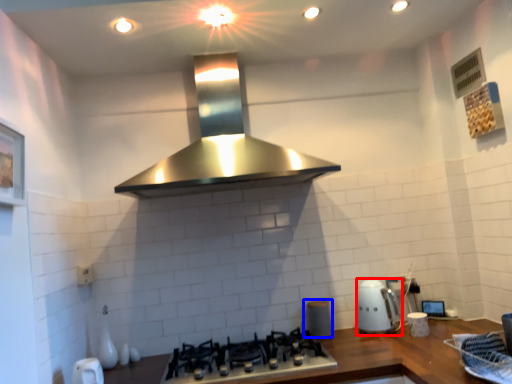
Question: Among these objects, which one is nearest to the camera, kitchen appliance (highlighted by a red box) or appliance (highlighted by a blue box)?

Choices:
 (A) kitchen appliance
 (B) appliance

Answer: (A)